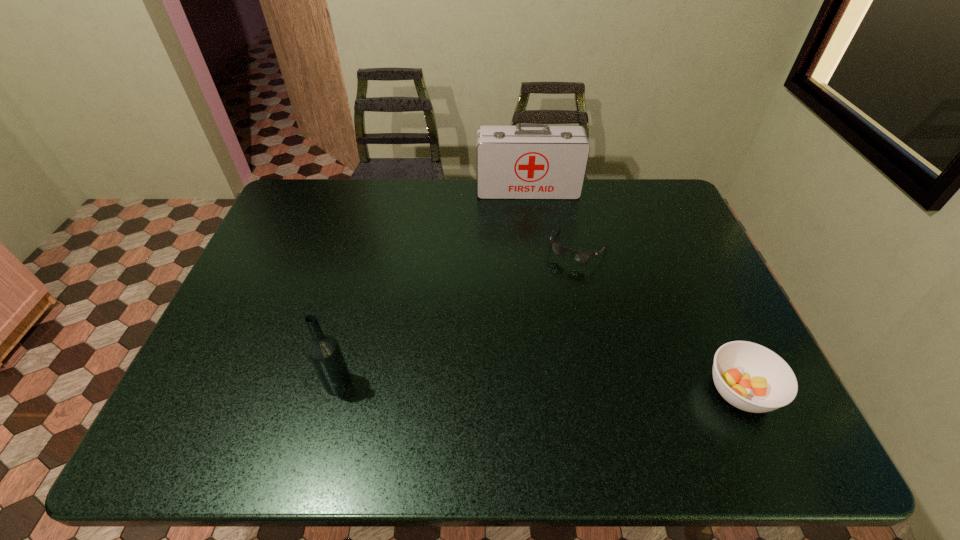
I want to click on vacant space located 0.140m on the front-facing side of the sunglasses, so click(548, 298).

This screenshot has width=960, height=540. I want to click on vacant space located 0.080m on the front-facing side of the first-aid kit, so pos(530,214).

The width and height of the screenshot is (960, 540). Find the location of `free space located on the front-facing side of the first-aid kit`. free space located on the front-facing side of the first-aid kit is located at coordinates (534, 245).

Where is `vacant position located 0.210m on the front-facing side of the first-aid kit`? The height and width of the screenshot is (540, 960). vacant position located 0.210m on the front-facing side of the first-aid kit is located at coordinates (533, 240).

Where is `object positioned at the far edge`? The width and height of the screenshot is (960, 540). object positioned at the far edge is located at coordinates (528, 161).

Image resolution: width=960 pixels, height=540 pixels. Identify the location of vodka located in the near edge section of the desktop. (325, 354).

This screenshot has width=960, height=540. I want to click on soup bowl present at the near edge, so click(751, 377).

You are a GUI agent. You are given a task and a screenshot of the screen. Output one action in this format:
    pyautogui.click(x=<x>, y=<y>)
    Task: Click on the object that is at the right edge
    This screenshot has height=540, width=960.
    Given the screenshot: What is the action you would take?
    pyautogui.click(x=751, y=377)

Locate an element on the screen. The image size is (960, 540). object present at the near right corner is located at coordinates 751,377.

In the image, there is a desktop. At what (x,y) coordinates should I click in order to perform the action: click on vacant space at the far edge. Please return your answer as a coordinate pair (x, y). Looking at the image, I should click on (464, 205).